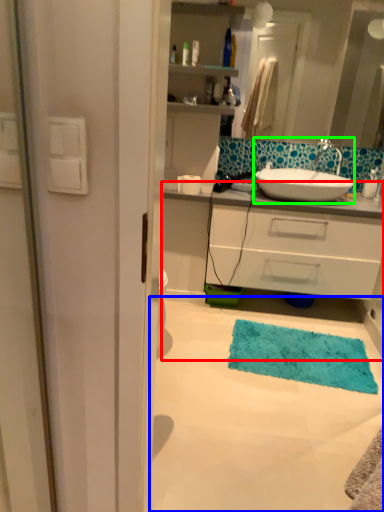
Question: Considering the real-world distances, which object is closest to bathroom cabinet (highlighted by a red box)? plain (highlighted by a blue box) or sink (highlighted by a green box).

Choices:
 (A) plain
 (B) sink

Answer: (B)